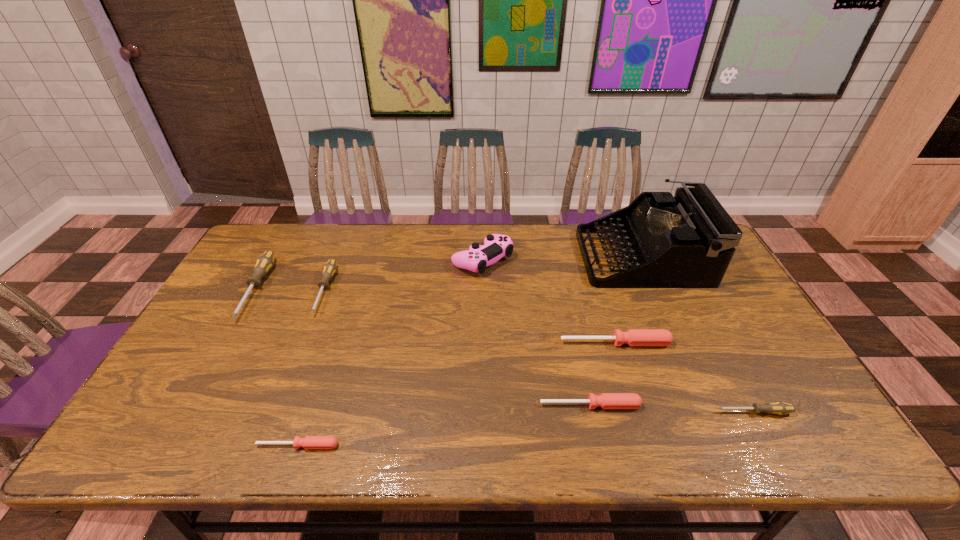
In order to click on typewriter present at the right edge in this screenshot , I will do `click(687, 241)`.

Find the location of `screwdriver positioned at the right edge`. screwdriver positioned at the right edge is located at coordinates (780, 408).

Locate an element on the screen. The height and width of the screenshot is (540, 960). object positioned at the far left corner is located at coordinates (264, 263).

The width and height of the screenshot is (960, 540). I want to click on object at the far right corner, so click(x=687, y=241).

The width and height of the screenshot is (960, 540). In order to click on object present at the near right corner in this screenshot , I will do `click(780, 408)`.

Where is `vacant space at the far edge of the desktop`? The height and width of the screenshot is (540, 960). vacant space at the far edge of the desktop is located at coordinates (559, 224).

At what (x,y) coordinates should I click in order to perform the action: click on free space at the near edge. Please return your answer as a coordinate pair (x, y). The height and width of the screenshot is (540, 960). Looking at the image, I should click on (701, 431).

Find the location of a particular element. The height and width of the screenshot is (540, 960). vacant region at the left edge of the desktop is located at coordinates (238, 273).

What are the coordinates of `free location at the right edge` in the screenshot? It's located at (709, 330).

Identify the location of vacant space at the near left corner of the desktop. This screenshot has width=960, height=540. (144, 440).